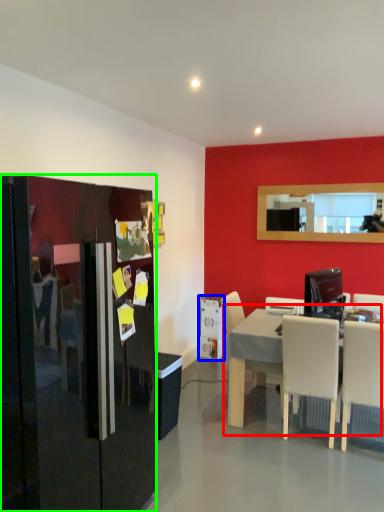
Question: Which object is the closest to the table (highlighted by a red box)? Choose among these: appliance (highlighted by a blue box) or refrigerator (highlighted by a green box).

Choices:
 (A) appliance
 (B) refrigerator

Answer: (B)